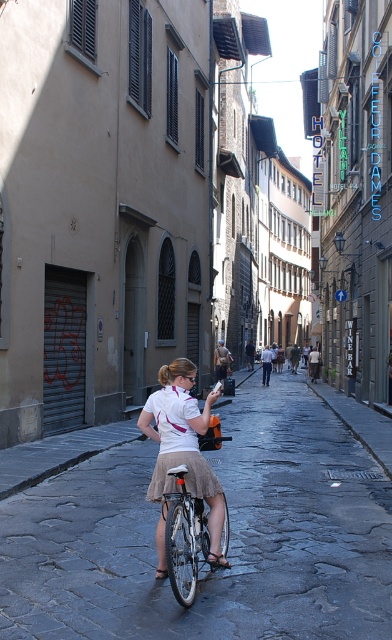
Does point (76, 484) come closer to viewer compared to point (188, 536)?

No, (76, 484) is further to viewer.

Between white fabric skirt at center and silver metallic bicycle at center, which one is positioned higher?

silver metallic bicycle at center is above.

What are the coordinates of `white fabric skirt at center` in the screenshot? It's located at (230, 540).

Between white fabric skirt at center and white matte skirt at center, which one is positioned higher?

white matte skirt at center is above.

Who is shorter, white fabric skirt at center or white matte skirt at center?

white fabric skirt at center

Is point (343, 460) closer to viewer compared to point (172, 460)?

No, it is not.

What are the coordinates of `white fabric skirt at center` in the screenshot? It's located at (230, 540).

Can you confirm if white matte skirt at center is positioned to the left of silver metallic bicycle at center?

Indeed, white matte skirt at center is positioned on the left side of silver metallic bicycle at center.

Is point (203, 412) less distant than point (183, 588)?

That is False.

I want to click on white matte skirt at center, so click(183, 445).